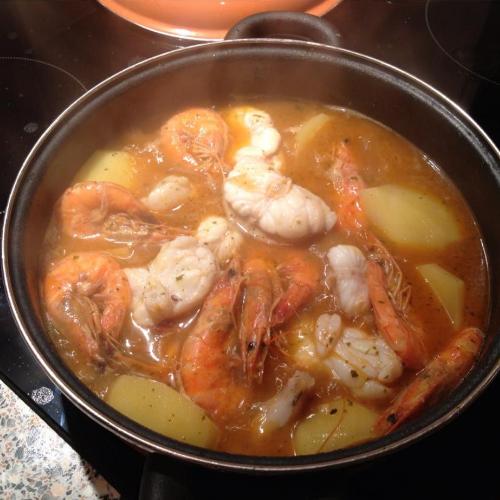
Locate an element on the screen. The width and height of the screenshot is (500, 500). pot handle area where pot is held is located at coordinates (52, 416).